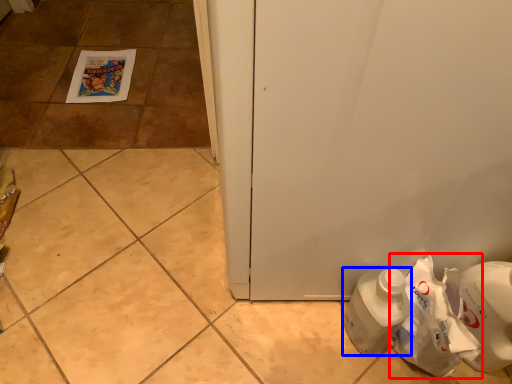
Question: Among these objects, which one is nearest to the camera, paper bag (highlighted by a red box) or bottle (highlighted by a blue box)?

Choices:
 (A) paper bag
 (B) bottle

Answer: (A)